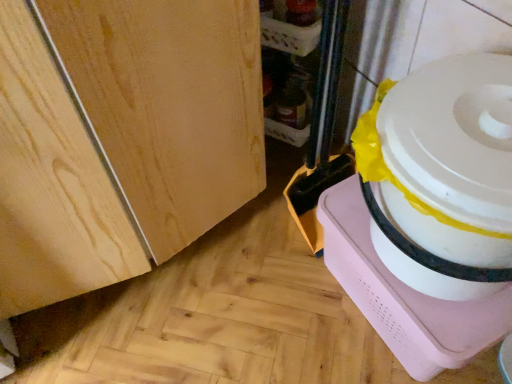
Where is `white plastic container at right`? This screenshot has height=384, width=512. white plastic container at right is located at coordinates (430, 213).

What do you see at coordinates (430, 213) in the screenshot?
I see `white plastic container at right` at bounding box center [430, 213].

The width and height of the screenshot is (512, 384). I want to click on white plastic container at right, so click(x=430, y=213).